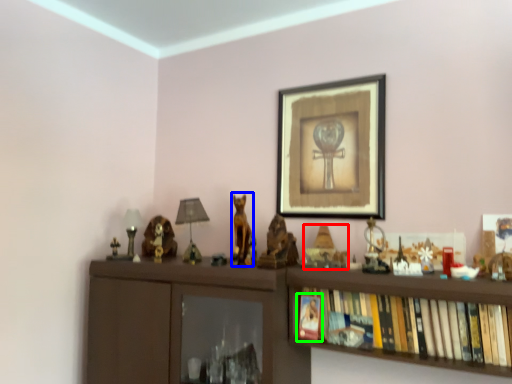
Question: Based on their relative distances, which object is farther from toy (highlighted by a red box)? Choose from animal (highlighted by a blue box) and book (highlighted by a green box).

Choices:
 (A) animal
 (B) book

Answer: (A)